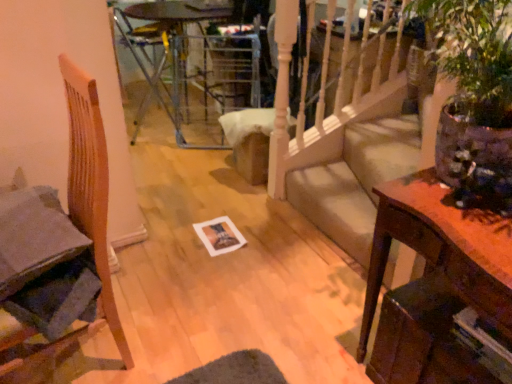
Question: Should I look upward or downward to see metallic silver armchair at upper center?

Choices:
 (A) down
 (B) up

Answer: (B)

Question: Is metallic silver armchair at upper center not inside wooden side table at right?

Choices:
 (A) yes
 (B) no

Answer: (A)

Question: From the image's perspective, is metallic silver armchair at upper center under wooden side table at right?

Choices:
 (A) no
 (B) yes

Answer: (A)

Question: Is metallic silver armchair at upper center wider than wooden side table at right?

Choices:
 (A) yes
 (B) no

Answer: (A)

Question: Does metallic silver armchair at upper center appear on the right side of wooden side table at right?

Choices:
 (A) yes
 (B) no

Answer: (B)

Question: From a real-world perspective, is metallic silver armchair at upper center positioned over wooden side table at right based on gravity?

Choices:
 (A) no
 (B) yes

Answer: (B)

Question: Considering the relative sizes of metallic silver armchair at upper center and wooden side table at right in the image provided, is metallic silver armchair at upper center smaller than wooden side table at right?

Choices:
 (A) no
 (B) yes

Answer: (A)

Question: Is matte paper magazine at lower right positioned far away from beige fabric couch at center?

Choices:
 (A) yes
 (B) no

Answer: (A)

Question: Is beige fabric couch at center located within matte paper magazine at lower right?

Choices:
 (A) yes
 (B) no

Answer: (B)

Question: Is matte paper magazine at lower right with beige fabric couch at center?

Choices:
 (A) no
 (B) yes

Answer: (A)

Question: Is matte paper magazine at lower right located outside beige fabric couch at center?

Choices:
 (A) no
 (B) yes

Answer: (B)

Question: Does matte paper magazine at lower right have a smaller size compared to beige fabric couch at center?

Choices:
 (A) no
 (B) yes

Answer: (B)

Question: Is matte paper magazine at lower right shorter than beige fabric couch at center?

Choices:
 (A) no
 (B) yes

Answer: (B)

Question: From the image's perspective, would you say wooden side table at right is positioned over wooden chair at left?

Choices:
 (A) yes
 (B) no

Answer: (B)